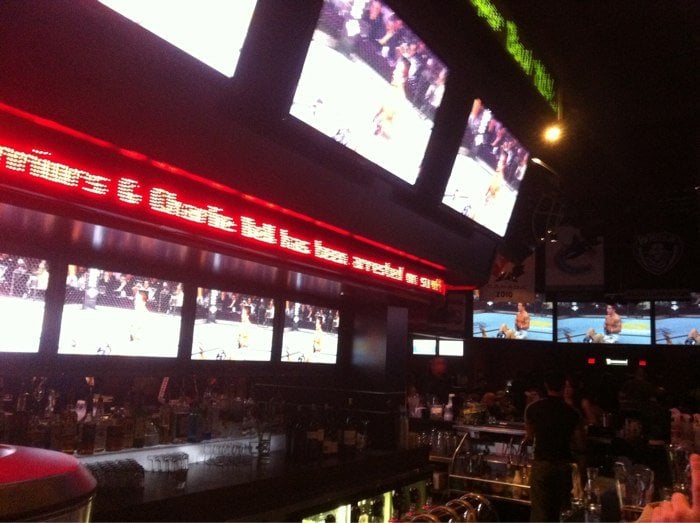
You are a GUI agent. You are given a task and a screenshot of the screen. Output one action in this format:
    pyautogui.click(x=<x>, y=<y>)
    Task: Click on the mat
    This screenshot has width=700, height=523.
    Given the screenshot: What is the action you would take?
    pyautogui.click(x=491, y=309), pyautogui.click(x=584, y=325), pyautogui.click(x=690, y=334), pyautogui.click(x=19, y=315), pyautogui.click(x=92, y=331), pyautogui.click(x=234, y=320), pyautogui.click(x=325, y=341), pyautogui.click(x=344, y=104), pyautogui.click(x=463, y=184), pyautogui.click(x=192, y=31)